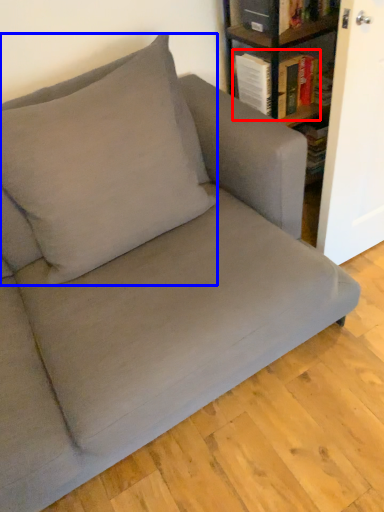
Question: Which object is further to the camera taking this photo, book (highlighted by a red box) or throw pillow (highlighted by a blue box)?

Choices:
 (A) book
 (B) throw pillow

Answer: (A)